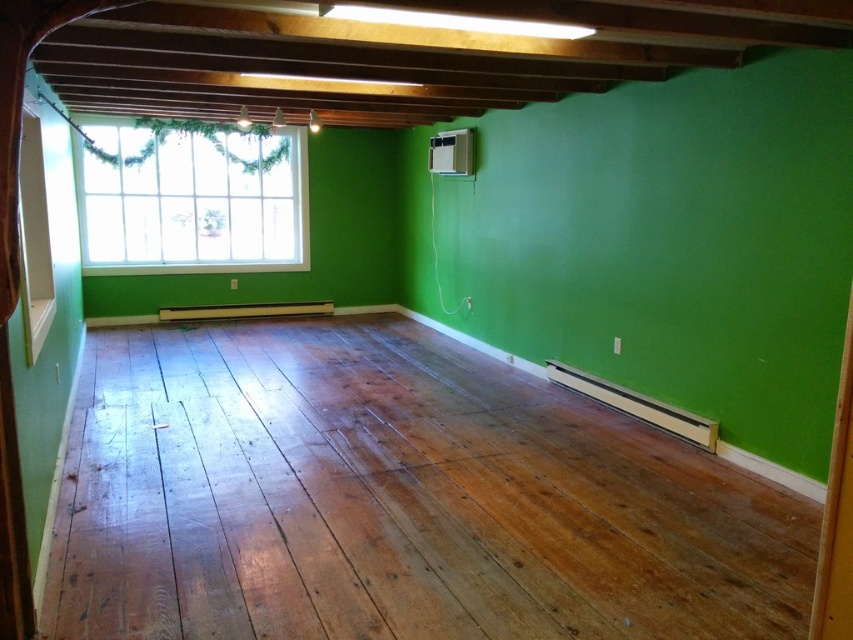
Is shiny brown wood floor at center below clear glass window at upper left?

Yes, shiny brown wood floor at center is below clear glass window at upper left.

Does shiny brown wood floor at center have a smaller size compared to clear glass window at upper left?

Yes, shiny brown wood floor at center is smaller than clear glass window at upper left.

Which is behind, point (380, 589) or point (149, 154)?

The point (149, 154) is behind.

The height and width of the screenshot is (640, 853). I want to click on shiny brown wood floor at center, so click(x=395, y=500).